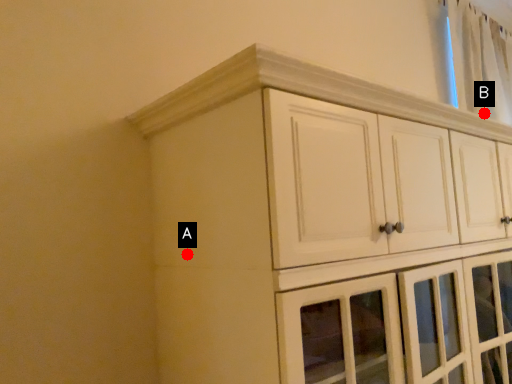
Question: Two points are circled on the image, labeled by A and B beside each circle. Which of the following is the farthest from the observer?

Choices:
 (A) A is further
 (B) B is further

Answer: (B)